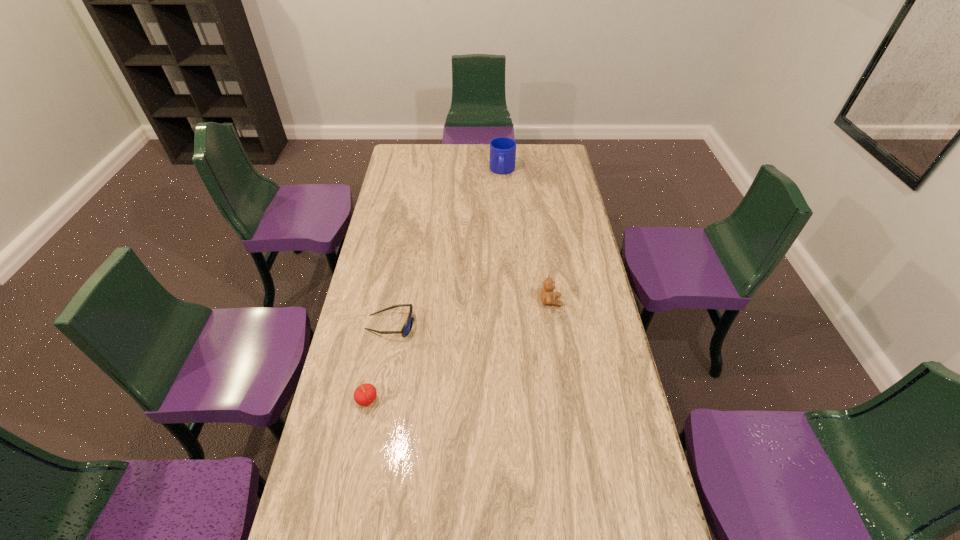
Find the location of a particular element. The image size is (960, 540). vacant space on the desktop that is between the cherry and the teddy bear and is positioned on the front-facing side of the shortest object is located at coordinates (489, 335).

Find the location of a particular element. This screenshot has width=960, height=540. vacant space on the desktop that is between the cherry and the rightmost object and is positioned on the side with the handle of the farthest object is located at coordinates (480, 339).